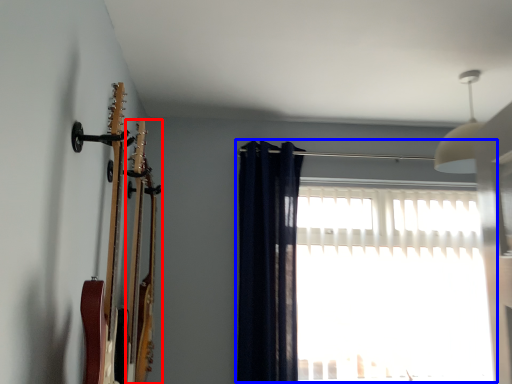
Question: Which object appears closest to the camera in this image, guitar (highlighted by a red box) or window (highlighted by a blue box)?

Choices:
 (A) guitar
 (B) window

Answer: (A)